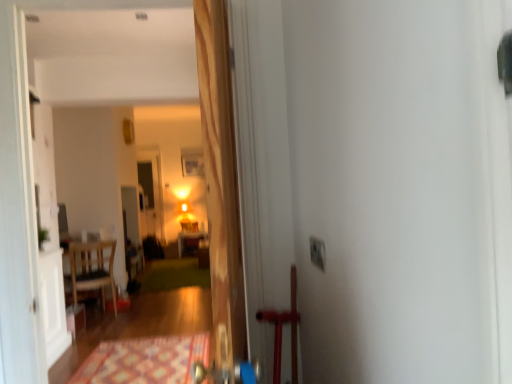
What is the approximate width of wooden door at center?

The width of wooden door at center is 15.52 centimeters.

Locate an element on the screen. The height and width of the screenshot is (384, 512). wooden door at center is located at coordinates (221, 190).

Image resolution: width=512 pixels, height=384 pixels. What do you see at coordinates (173, 275) in the screenshot?
I see `green carpet at center, which is the 2th doormat from front to back` at bounding box center [173, 275].

Image resolution: width=512 pixels, height=384 pixels. I want to click on green carpet at center, positioned as the 1th doormat in back-to-front order, so click(173, 275).

Measure the distance between patterned carpet at lower center, which appears as the first doormat when viewed from the front, and camera.

A distance of 2.79 meters exists between patterned carpet at lower center, which appears as the first doormat when viewed from the front, and camera.

This screenshot has width=512, height=384. What are the coordinates of `wooden chair at left` in the screenshot? It's located at (92, 269).

Is point (194, 243) closer or farther from the camera than point (103, 266)?

Point (194, 243) appears to be farther away from the viewer than point (103, 266).

From a real-world perspective, which object stands above the other?

wooden chair at left, from a real-world perspective.

Considering the relative positions of wooden table at center and wooden chair at left in the image provided, is wooden table at center to the left of wooden chair at left from the viewer's perspective?

Incorrect, wooden table at center is not on the left side of wooden chair at left.

Looking at this image, is wooden table at center wider than wooden chair at left?

Correct, the width of wooden table at center exceeds that of wooden chair at left.

Could you tell me if wooden door at center is turned towards wooden table at center?

No, wooden door at center does not turn towards wooden table at center.

Find the location of `door that is in front of the wooden table at center`. door that is in front of the wooden table at center is located at coordinates (x=221, y=190).

From the image's perspective, would you say wooden door at center is positioned over wooden table at center?

Correct, wooden door at center appears higher than wooden table at center in the image.

Is wooden door at center beside wooden table at center?

No, wooden door at center is not with wooden table at center.

This screenshot has height=384, width=512. Find the location of `chair below the wooden door at center (from a real-world perspective)`. chair below the wooden door at center (from a real-world perspective) is located at coordinates (92, 269).

In the image, is wooden door at center positioned in front of or behind wooden chair at left?

Visually, wooden door at center is located in front of wooden chair at left.

In terms of height, does wooden door at center look taller or shorter compared to wooden chair at left?

Clearly, wooden door at center is taller compared to wooden chair at left.

Looking at the image, does wooden chair at left seem bigger or smaller compared to green carpet at center, positioned as the 1th doormat in back-to-front order?

wooden chair at left is bigger than green carpet at center, positioned as the 1th doormat in back-to-front order.

Considering the relative sizes of wooden chair at left and green carpet at center, which is the 2th doormat from front to back, in the image provided, is wooden chair at left taller than green carpet at center, which is the 2th doormat from front to back,?

Yes, wooden chair at left is taller than green carpet at center, which is the 2th doormat from front to back.

From the image's perspective, is wooden chair at left positioned above or below green carpet at center, which is the 2th doormat from front to back?

From the image's perspective, wooden chair at left appears above green carpet at center, which is the 2th doormat from front to back.

Consider the image. Would you say wooden chair at left is to the left or to the right of green carpet at center, positioned as the 1th doormat in back-to-front order, in the picture?

Clearly, wooden chair at left is on the left of green carpet at center, positioned as the 1th doormat in back-to-front order, in the image.

Considering the positions of points (75, 277) and (322, 268), is point (75, 277) closer to camera compared to point (322, 268)?

That is False.

Considering the positions of objects wooden chair at left and white plastic electric outlet at upper right in the image provided, who is behind, wooden chair at left or white plastic electric outlet at upper right?

wooden chair at left.

From the image's perspective, is wooden chair at left located above or below white plastic electric outlet at upper right?

Clearly, from the image's perspective, wooden chair at left is below white plastic electric outlet at upper right.

Considering the relative sizes of wooden chair at left and white plastic electric outlet at upper right in the image provided, is wooden chair at left taller than white plastic electric outlet at upper right?

Indeed, wooden chair at left has a greater height compared to white plastic electric outlet at upper right.

Between green carpet at center, positioned as the 1th doormat in back-to-front order, and white plastic electric outlet at upper right, which one has larger size?

Bigger between the two is green carpet at center, positioned as the 1th doormat in back-to-front order.

Is green carpet at center, positioned as the 1th doormat in back-to-front order, taller or shorter than white plastic electric outlet at upper right?

green carpet at center, positioned as the 1th doormat in back-to-front order, is shorter than white plastic electric outlet at upper right.

Is green carpet at center, which is the 2th doormat from front to back, thinner than white plastic electric outlet at upper right?

No.

From a real-world perspective, which object stands above the other?

From a 3D spatial view, white plastic electric outlet at upper right is above.

Based on the photo, between patterned carpet at lower center, which ranks as the 2th doormat in back-to-front order, and wooden table at center, which one appears on the left side from the viewer's perspective?

Positioned to the left is wooden table at center.

Is the position of patterned carpet at lower center, which ranks as the 2th doormat in back-to-front order, less distant than that of wooden table at center?

That is True.

Measure the distance between patterned carpet at lower center, which appears as the first doormat when viewed from the front, and wooden table at center.

patterned carpet at lower center, which appears as the first doormat when viewed from the front, and wooden table at center are 3.72 meters apart from each other.

From their relative heights in the image, would you say patterned carpet at lower center, which ranks as the 2th doormat in back-to-front order, is taller or shorter than wooden table at center?

Clearly, patterned carpet at lower center, which ranks as the 2th doormat in back-to-front order, is shorter compared to wooden table at center.

At what (x,y) coordinates should I click in order to perform the action: click on table that appears behind the wooden chair at left. Please return your answer as a coordinate pair (x, y). The width and height of the screenshot is (512, 384). Looking at the image, I should click on (189, 242).

Where is `table lying below the wooden door at center (from the image's perspective)`? Image resolution: width=512 pixels, height=384 pixels. table lying below the wooden door at center (from the image's perspective) is located at coordinates (189, 242).

When comparing their distances from wooden table at center, does patterned carpet at lower center, which appears as the first doormat when viewed from the front, or green carpet at center, positioned as the 1th doormat in back-to-front order, seem closer?

green carpet at center, positioned as the 1th doormat in back-to-front order.

Considering their positions, is wooden table at center positioned closer to patterned carpet at lower center, which ranks as the 2th doormat in back-to-front order, than white plastic electric outlet at upper right?

white plastic electric outlet at upper right lies closer to patterned carpet at lower center, which ranks as the 2th doormat in back-to-front order, than the other object.

Looking at the image, which one is located further to patterned carpet at lower center, which ranks as the 2th doormat in back-to-front order, wooden chair at left or wooden table at center?

The object further to patterned carpet at lower center, which ranks as the 2th doormat in back-to-front order, is wooden table at center.

From the image, which object appears to be nearer to wooden table at center, green carpet at center, which is the 2th doormat from front to back, or wooden chair at left?

Among the two, green carpet at center, which is the 2th doormat from front to back, is located nearer to wooden table at center.

Consider the image. Estimate the real-world distances between objects in this image. Which object is closer to wooden chair at left, patterned carpet at lower center, which ranks as the 2th doormat in back-to-front order, or wooden door at center?

patterned carpet at lower center, which ranks as the 2th doormat in back-to-front order.

When comparing their distances from wooden table at center, does white plastic electric outlet at upper right or wooden door at center seem closer?

The object closer to wooden table at center is wooden door at center.

When comparing their distances from wooden chair at left, does wooden door at center or patterned carpet at lower center, which appears as the first doormat when viewed from the front, seem further?

Based on the image, wooden door at center appears to be further to wooden chair at left.

Estimate the real-world distances between objects in this image. Which object is closer to white plastic electric outlet at upper right, green carpet at center, positioned as the 1th doormat in back-to-front order, or wooden door at center?

The object closer to white plastic electric outlet at upper right is wooden door at center.

Identify the location of doormat located between white plastic electric outlet at upper right and green carpet at center, which is the 2th doormat from front to back, in the depth direction. (144, 360).

Find the location of `chair between patterned carpet at lower center, which appears as the first doormat when viewed from the front, and wooden table at center, along the z-axis`. chair between patterned carpet at lower center, which appears as the first doormat when viewed from the front, and wooden table at center, along the z-axis is located at coordinates (92, 269).

Locate an element on the screen. Image resolution: width=512 pixels, height=384 pixels. electric outlet between wooden door at center and patterned carpet at lower center, which ranks as the 2th doormat in back-to-front order, in the front-back direction is located at coordinates (317, 252).

Find the location of a particular element. The width and height of the screenshot is (512, 384). chair between white plastic electric outlet at upper right and wooden table at center along the z-axis is located at coordinates (92, 269).